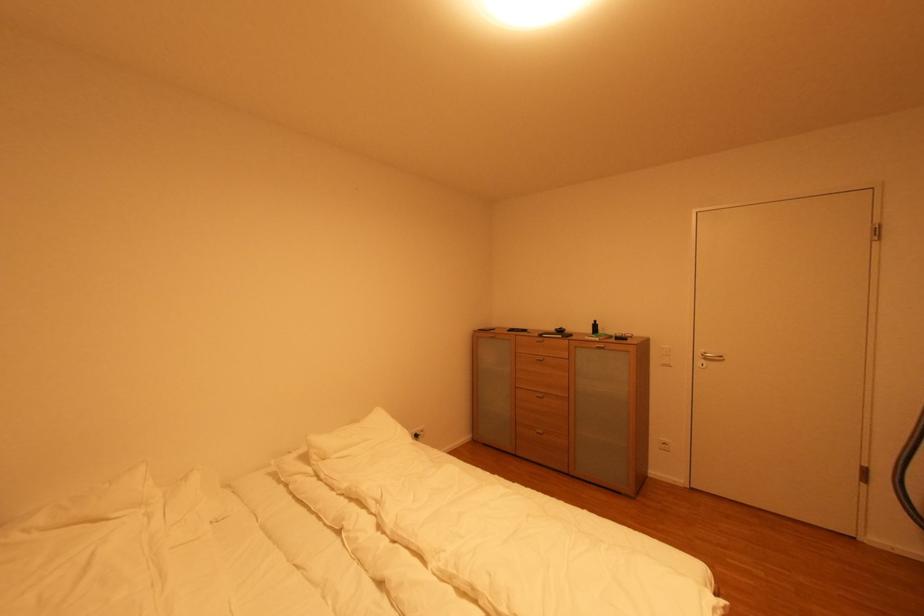
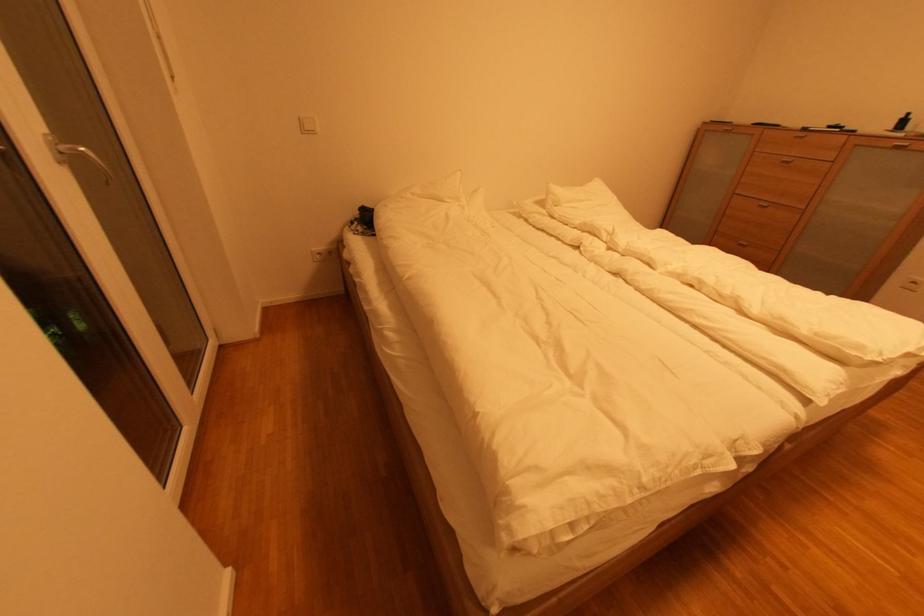
The images are taken continuously from a first-person perspective. In which direction is your viewpoint rotating?

The camera's rotation is toward left-down.